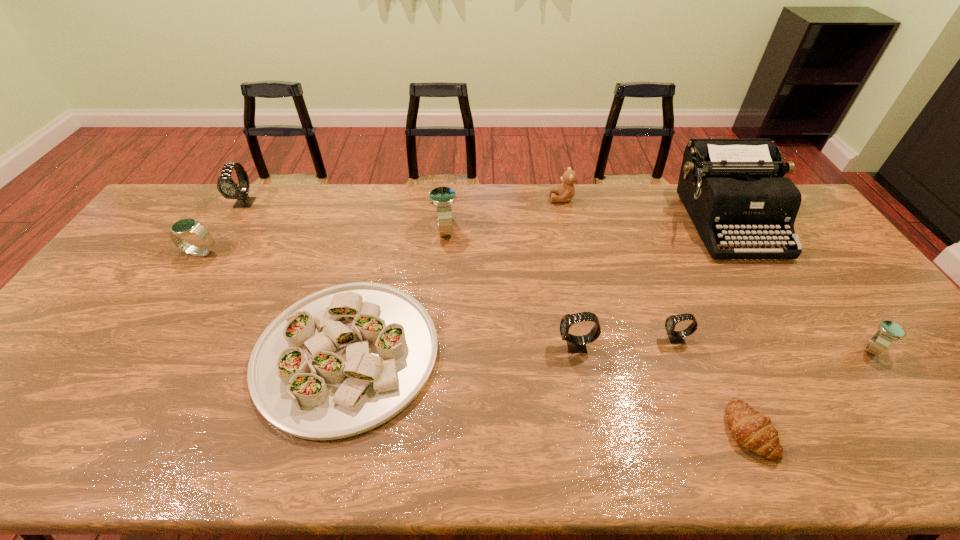
Locate an element on the screen. the tallest object is located at coordinates (725, 185).

Identify the location of the leftmost gray watch. The height and width of the screenshot is (540, 960). (226, 186).

Identify the location of the biggest gray watch. The width and height of the screenshot is (960, 540). (226, 186).

Identify the location of the biggest blue watch. (443, 198).

Where is `the second blue watch from left to right`? the second blue watch from left to right is located at coordinates (443, 198).

This screenshot has width=960, height=540. Find the location of `the second biggest gray watch`. the second biggest gray watch is located at coordinates (576, 344).

Find the location of a particular element. The width and height of the screenshot is (960, 540). the third watch from right to left is located at coordinates (576, 344).

Locate an element on the screen. This screenshot has height=540, width=960. brown teddy bear is located at coordinates (566, 191).

This screenshot has width=960, height=540. In order to click on the second nearest blue watch in this screenshot , I will do `click(187, 226)`.

Find the location of `the leftmost blue watch`. the leftmost blue watch is located at coordinates (187, 226).